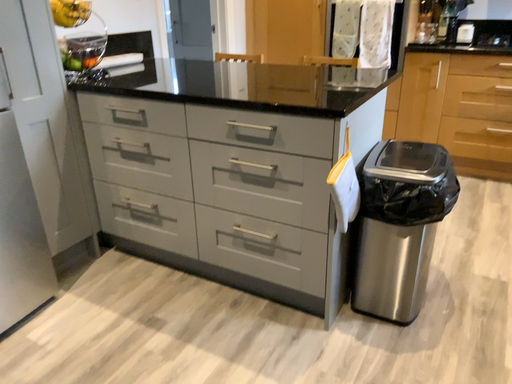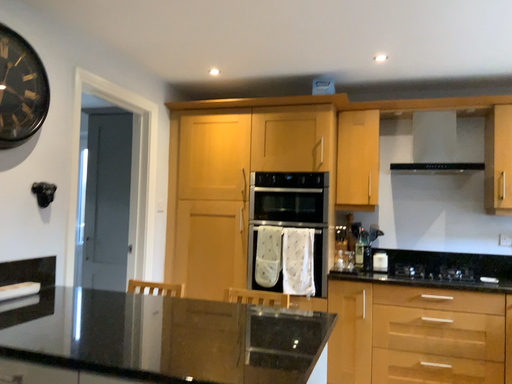
Question: Which way did the camera rotate in the video?

Choices:
 (A) rotated left
 (B) rotated right

Answer: (B)